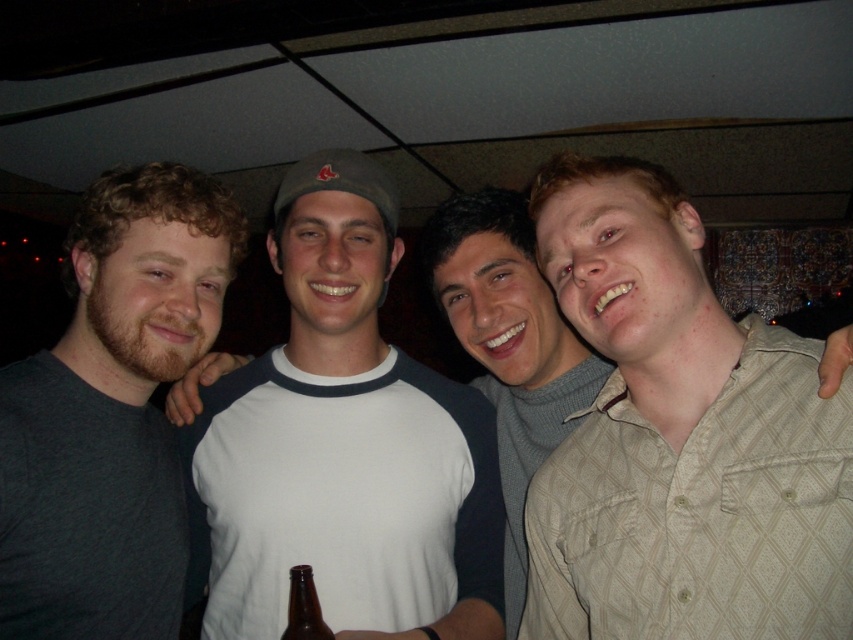
Question: Which of the following is the farthest from the observer?

Choices:
 (A) brown glass bottle at center
 (B) white cotton t-shirt at center

Answer: (B)

Question: Does white cotton t-shirt at center have a greater width compared to dark gray t-shirt at left?

Choices:
 (A) yes
 (B) no

Answer: (A)

Question: Which of the following is the farthest from the observer?

Choices:
 (A) (138, 474)
 (B) (343, 538)
 (C) (792, 472)

Answer: (A)

Question: Is light beige textured shirt at right behind white cotton shirt at center?

Choices:
 (A) yes
 (B) no

Answer: (B)

Question: Does light beige textured shirt at right come in front of brown glass bottle at center?

Choices:
 (A) yes
 (B) no

Answer: (A)

Question: Which object is farther from the camera taking this photo?

Choices:
 (A) light beige textured shirt at right
 (B) white cotton t-shirt at center

Answer: (B)